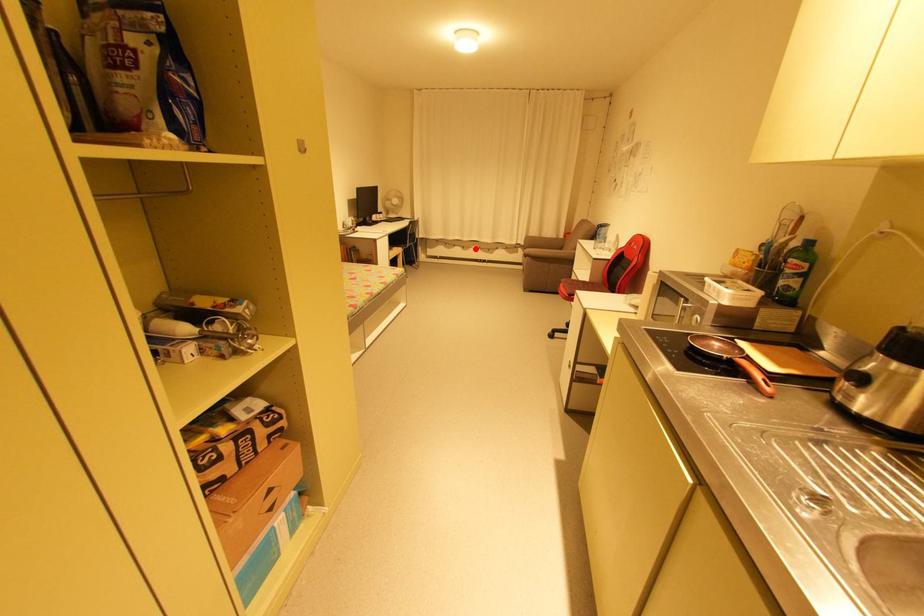
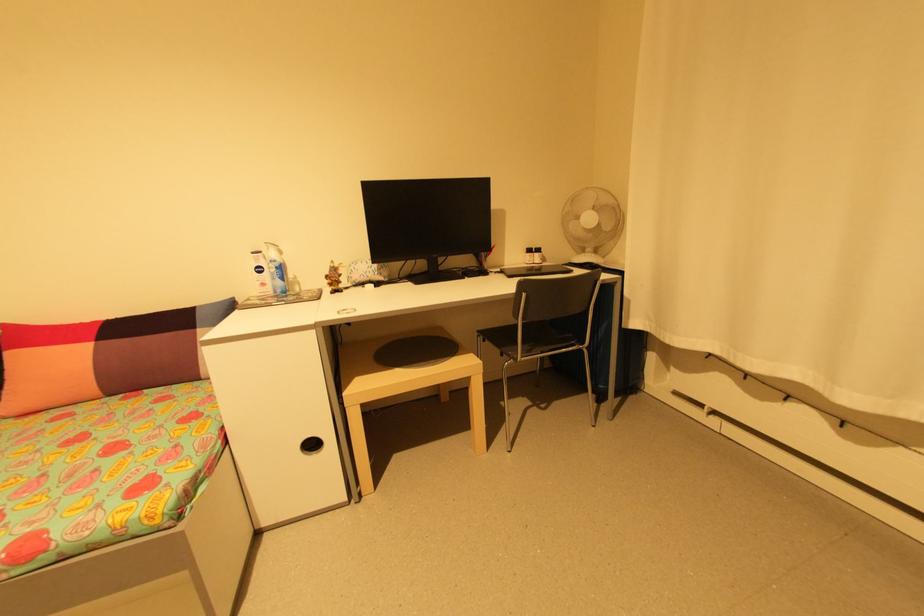
In the second image, find the point that corresponds to the highlighted location in the first image.

(906, 448)